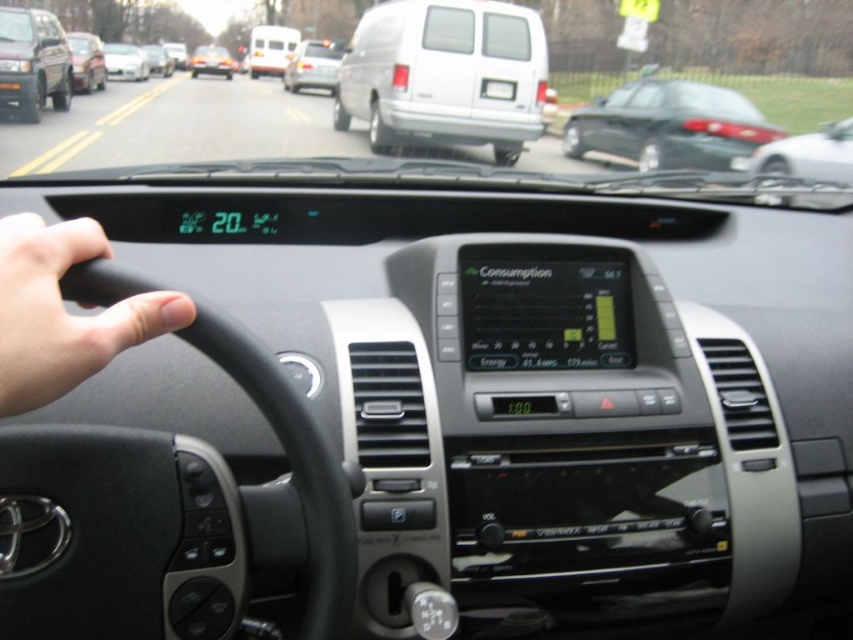
You are a passenger in the matte black van at left and want to exit the vehicle. Can you safely open the door without hitting the metallic silver car at right?

The matte black van at left is located above the metallic silver car at right, which means it is positioned higher or in a different vertical plane. However, this does not necessarily indicate horizontal proximity. Without information about their lateral distance, it is uncertain if opening the door would hit the metallic silver car at right. Check the side mirrors or physically look outside to confirm the distance before opening the door.

From the picture: You are driving a car and want to park in a parking spot that is exactly the width of the metallic silver car at right. Can the white matte van at center fit into this parking spot without touching the sides?

The white matte van at center has a lesser width compared to the metallic silver car at right, so it can fit into the parking spot designed for the metallic silver car at right without touching the sides.

You are sitting in the driver seat of the vehicle shown. You notice two points marked on the windshield. The first point is at coordinate point (4, 70) and the second is at coordinate point (828, 198). Which point is closer to your eyes?

Point (4, 70) is further to the camera than point (828, 198), so the point closer to your eyes is point (828, 198).